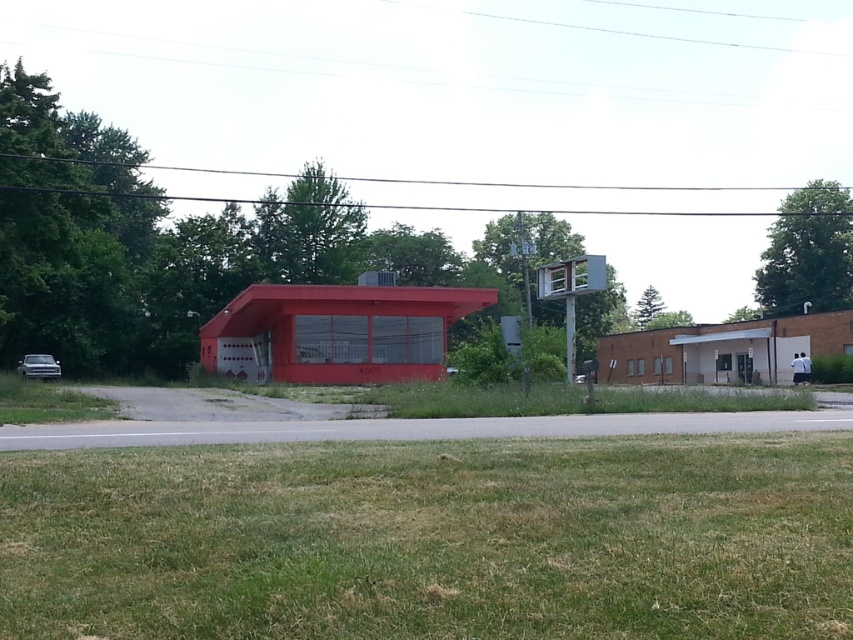
Is point (415, 339) farther from camera compared to point (18, 371)?

Yes, it is behind point (18, 371).

Is matte red fire station at center bigger than metallic silver car at lower left?

Yes, matte red fire station at center is bigger than metallic silver car at lower left.

Measure the distance between point (253, 340) and camera.

Point (253, 340) is 48.32 meters away from camera.

Find the location of a particular element. The image size is (853, 640). matte red fire station at center is located at coordinates (335, 332).